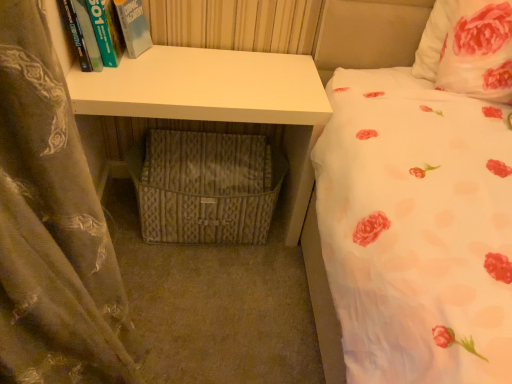
Question: From a real-world perspective, is white floral fabric pillow at upper right below woven fabric crate at lower center?

Choices:
 (A) yes
 (B) no

Answer: (B)

Question: From a real-world perspective, is white floral fabric pillow at upper right over woven fabric crate at lower center?

Choices:
 (A) yes
 (B) no

Answer: (A)

Question: Is white floral fabric pillow at upper right next to woven fabric crate at lower center and touching it?

Choices:
 (A) no
 (B) yes

Answer: (A)

Question: Does white floral fabric pillow at upper right turn towards woven fabric crate at lower center?

Choices:
 (A) yes
 (B) no

Answer: (B)

Question: Is white floral fabric pillow at upper right at the left side of woven fabric crate at lower center?

Choices:
 (A) no
 (B) yes

Answer: (A)

Question: From a real-world perspective, is woven fabric crate at lower center physically located above or below hardcover book at upper left?

Choices:
 (A) above
 (B) below

Answer: (B)

Question: In terms of size, does woven fabric crate at lower center appear bigger or smaller than hardcover book at upper left?

Choices:
 (A) small
 (B) big

Answer: (B)

Question: From the image's perspective, is woven fabric crate at lower center above or below hardcover book at upper left?

Choices:
 (A) above
 (B) below

Answer: (B)

Question: Is woven fabric crate at lower center taller or shorter than hardcover book at upper left?

Choices:
 (A) short
 (B) tall

Answer: (B)

Question: Looking at the image, does hardcover book at upper left seem bigger or smaller compared to brown sheer curtain at left?

Choices:
 (A) big
 (B) small

Answer: (B)

Question: Is hardcover book at upper left wider or thinner than brown sheer curtain at left?

Choices:
 (A) wide
 (B) thin

Answer: (B)

Question: Is point (110, 41) closer or farther from the camera than point (0, 304)?

Choices:
 (A) farther
 (B) closer

Answer: (A)

Question: Would you say hardcover book at upper left is to the left or to the right of brown sheer curtain at left in the picture?

Choices:
 (A) left
 (B) right

Answer: (A)

Question: Do you think brown sheer curtain at left is within hardcover book at upper left, or outside of it?

Choices:
 (A) outside
 (B) inside

Answer: (A)

Question: Is point 122,311 positioned closer to the camera than point 89,21?

Choices:
 (A) farther
 (B) closer

Answer: (B)